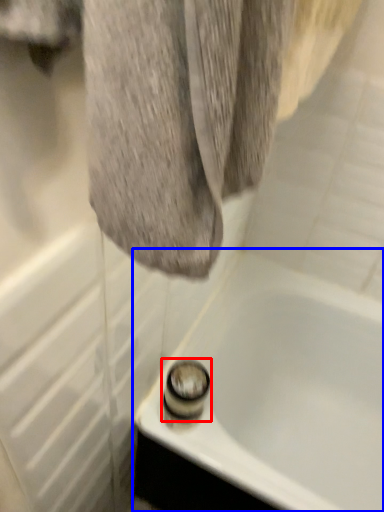
Question: Among these objects, which one is nearest to the camera, shower (highlighted by a red box) or bathtub (highlighted by a blue box)?

Choices:
 (A) shower
 (B) bathtub

Answer: (B)